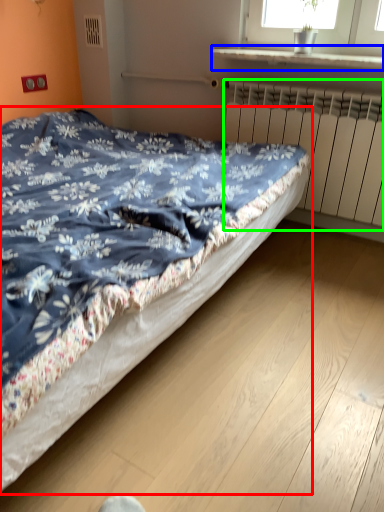
Question: Considering the real-world distances, which object is closest to bed (highlighted by a red box)? window sill (highlighted by a blue box) or radiator (highlighted by a green box).

Choices:
 (A) window sill
 (B) radiator

Answer: (B)